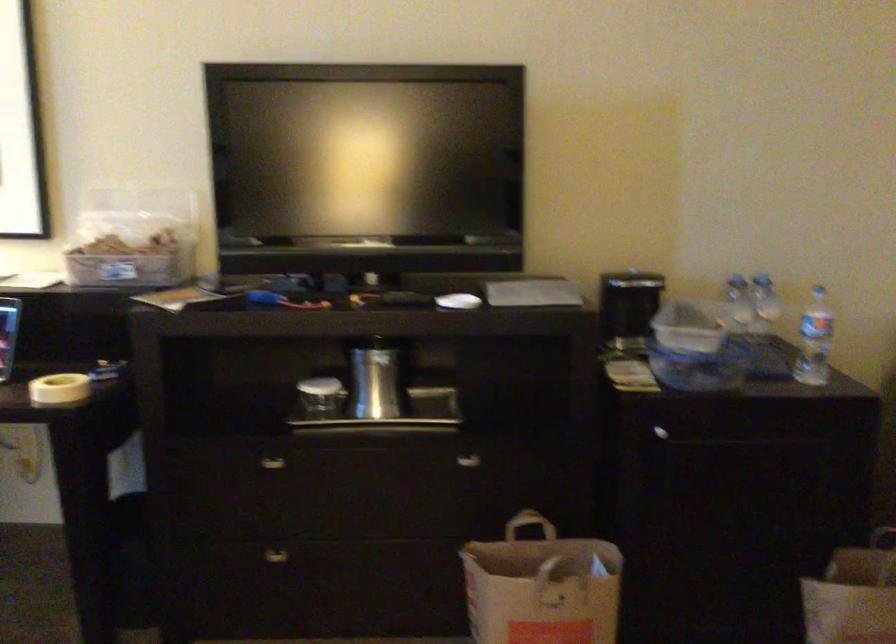
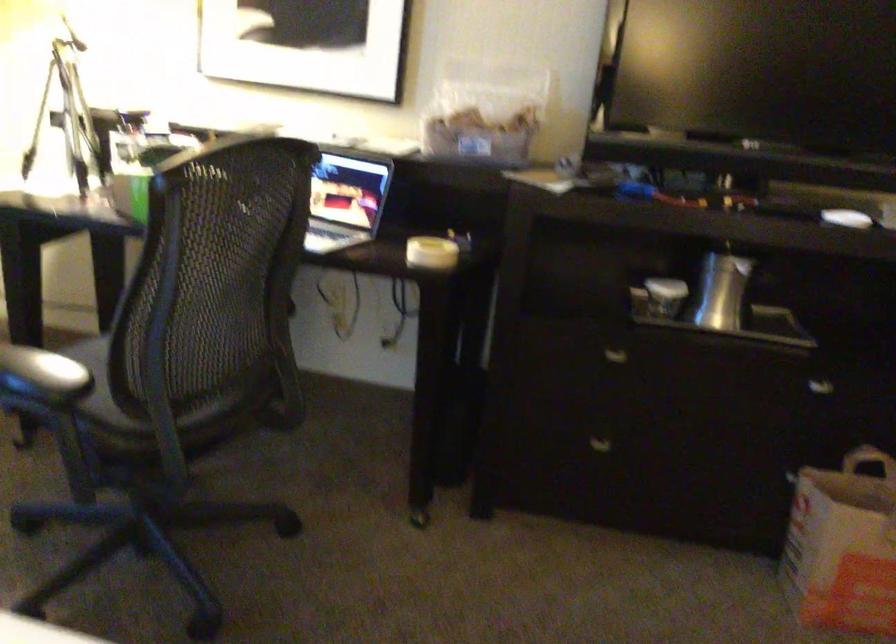
The point at (468, 468) is marked in the first image. Where is the corresponding point in the second image?

(821, 389)